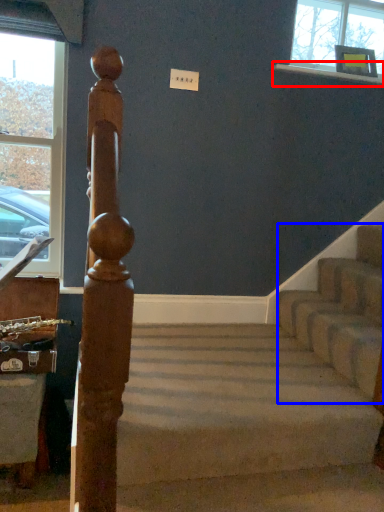
Question: Which object is further to the camera taking this photo, window sill (highlighted by a red box) or stairwell (highlighted by a blue box)?

Choices:
 (A) window sill
 (B) stairwell

Answer: (A)